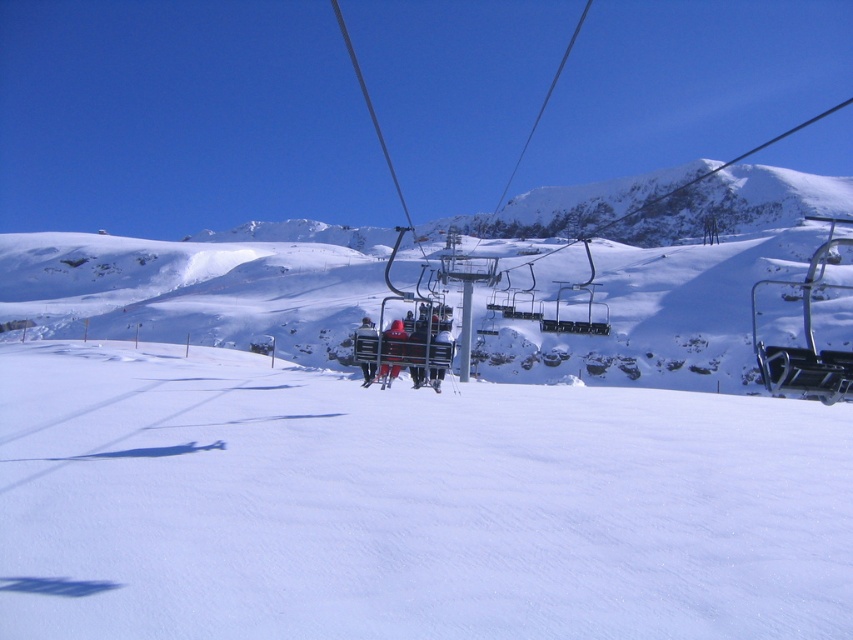
You are a photographer trying to capture a clear shot of the red fabric jacket at center and the matte red jacket at center. Which jacket will appear more prominent in your photo due to its position relative to the camera?

The red fabric jacket at center will appear more prominent in the photo because it is positioned in front of the matte red jacket at center, making it closer to the camera.

You are a photographer positioned at the bottom of the slope and want to take a photo of both the matte red jacket at center and the black fabric jacket at center. However, you notice that one of them is partially hidden. Which jacket will appear in front of the other in your photo?

The matte red jacket at center will appear in front of the black fabric jacket at center because the black fabric jacket at center is behind it.